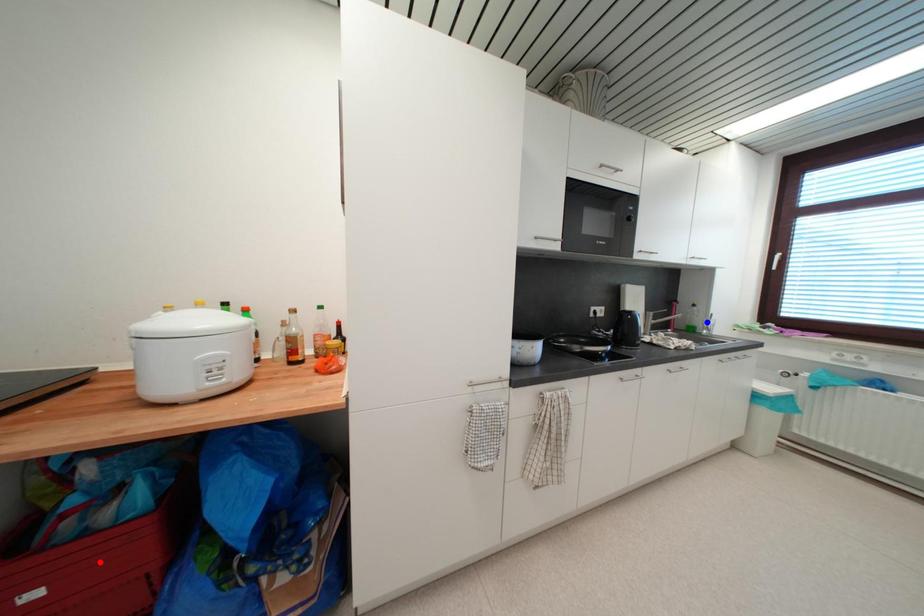
Question: In the image, two points are highlighted. Which point is nearer to the camera? Reply with the corresponding letter.

Choices:
 (A) blue point
 (B) red point

Answer: (B)